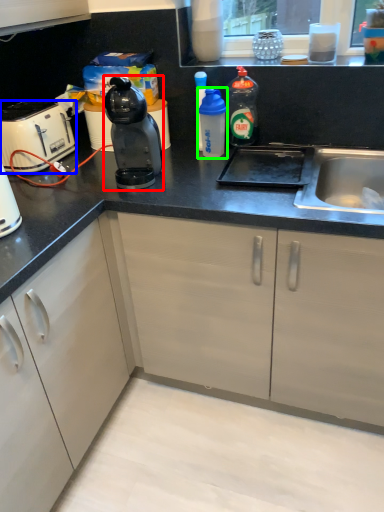
Question: Which object is the closest to the kitchen appliance (highlighted by a red box)? Choose among these: home appliance (highlighted by a blue box) or bottle (highlighted by a green box).

Choices:
 (A) home appliance
 (B) bottle

Answer: (B)